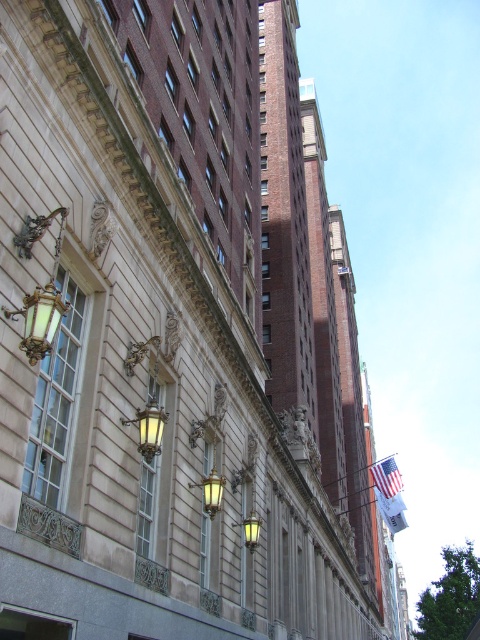
Question: Among these points, which one is farthest from the camera?

Choices:
 (A) (395, 502)
 (B) (157, 417)

Answer: (A)

Question: Does matte glass lamp at left have a lesser width compared to matte yellow glass at lower center?

Choices:
 (A) no
 (B) yes

Answer: (A)

Question: Which point is closer to the camera taking this photo?

Choices:
 (A) (253, 531)
 (B) (388, 506)
 (C) (32, 314)

Answer: (C)

Question: Is matte gold light fixture at lower center to the left of white fabric flag at lower right from the viewer's perspective?

Choices:
 (A) yes
 (B) no

Answer: (A)

Question: Does matte brass lamp at center appear on the right side of matte yellow glass at lower center?

Choices:
 (A) no
 (B) yes

Answer: (A)

Question: Which point appears farthest from the camera in this image?

Choices:
 (A) (157, 404)
 (B) (210, 481)
 (C) (391, 509)
 (D) (394, 468)

Answer: (C)